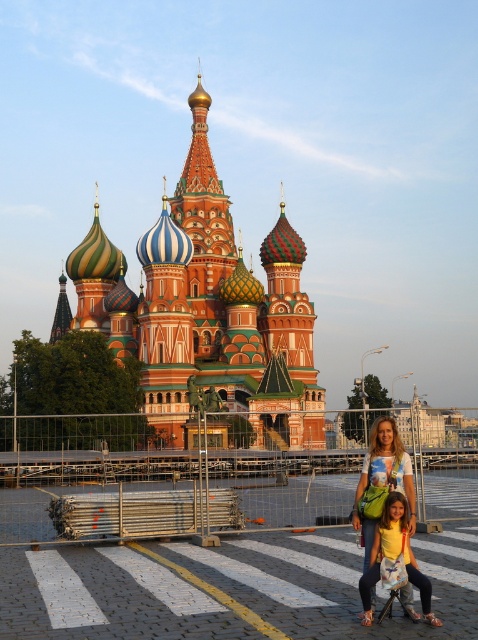
Consider the image. You are standing at the pedestrian crossing and want to take a photo of the multicolored mosaic church at center. Where should you position yourself to ensure the point at coordinates point (206, 307) is clearly visible in your photo?

You should position yourself so that the camera is facing the multicolored mosaic church at center, as the point at coordinates point (206, 307) is located on it, ensuring it will be visible in the photo.